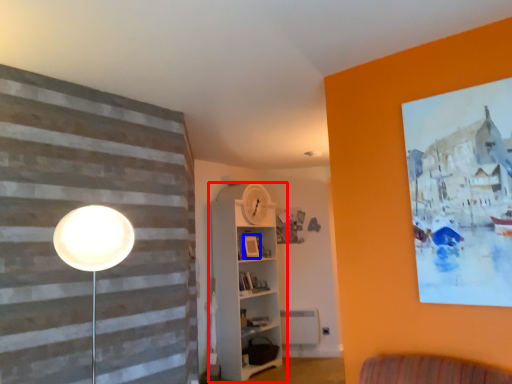
Question: Which of the following is the farthest to the observer, shelf (highlighted by a red box) or picture frame (highlighted by a blue box)?

Choices:
 (A) shelf
 (B) picture frame

Answer: (B)